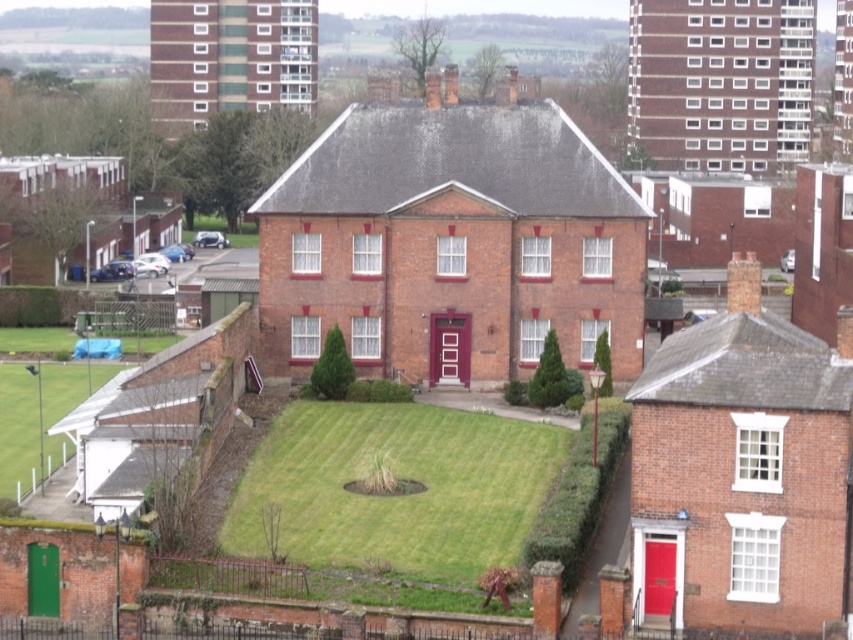
Does green grass at center have a greater height compared to green grass at lower left?

No.

Can you confirm if green grass at center is wider than green grass at lower left?

Correct, the width of green grass at center exceeds that of green grass at lower left.

The height and width of the screenshot is (640, 853). I want to click on green grass at center, so click(x=393, y=497).